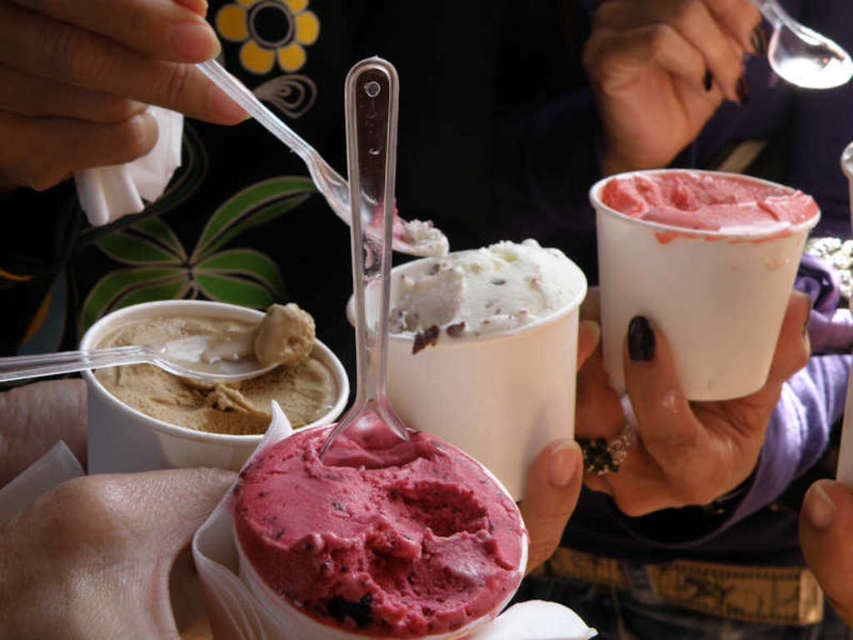
Question: Among these points, which one is farthest from the camera?

Choices:
 (A) (733, 472)
 (B) (148, 323)

Answer: (A)

Question: Is black nail polish at upper right below nail polish at upper center?

Choices:
 (A) yes
 (B) no

Answer: (A)

Question: Does pink matte skin at lower left have a smaller size compared to smooth chocolate chip ice cream at center?

Choices:
 (A) yes
 (B) no

Answer: (A)

Question: Which of the following is the closest to the observer?

Choices:
 (A) (242, 506)
 (B) (427, 294)

Answer: (A)

Question: Can you confirm if pink matte skin at lower left is bigger than nail polish at upper center?

Choices:
 (A) yes
 (B) no

Answer: (B)

Question: Among these objects, which one is nearest to the camera?

Choices:
 (A) pink matte skin at lower left
 (B) smooth beige ice cream at lower left

Answer: (A)